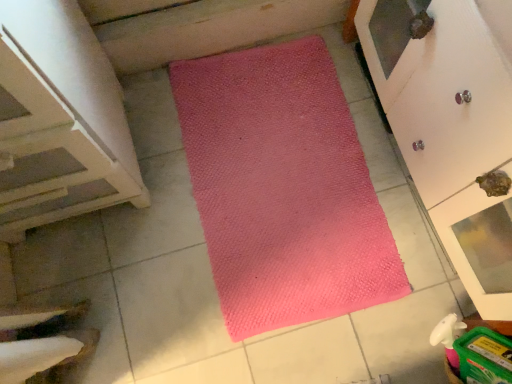
Question: From a real-world perspective, is matte white cupboard at upper right above or below white wood stairs at left?

Choices:
 (A) above
 (B) below

Answer: (B)

Question: Is matte white cupboard at upper right bigger or smaller than white wood stairs at left?

Choices:
 (A) small
 (B) big

Answer: (A)

Question: Based on their relative distances, which object is farther from the matte white cupboard at upper right?

Choices:
 (A) white wood stairs at left
 (B) pink textured mat at center

Answer: (A)

Question: Considering the real-world distances, which object is farthest from the matte white cupboard at upper right?

Choices:
 (A) pink textured mat at center
 (B) white wood stairs at left

Answer: (B)